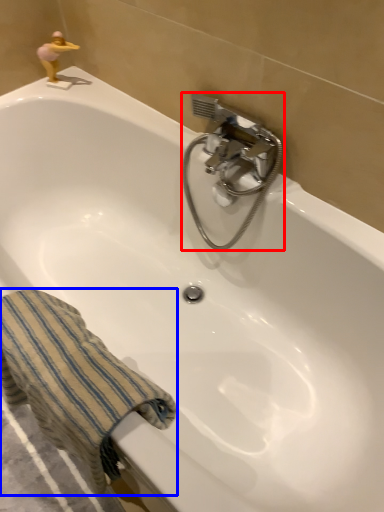
Question: Which object is further to the camera taking this photo, plumbing fixture (highlighted by a red box) or towel/napkin (highlighted by a blue box)?

Choices:
 (A) plumbing fixture
 (B) towel/napkin

Answer: (A)